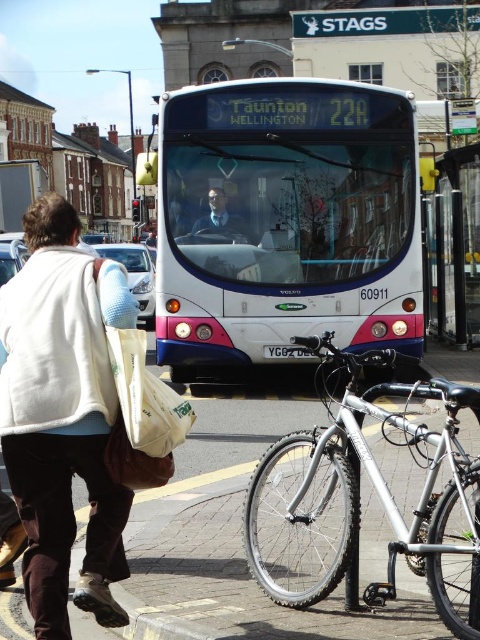
You are standing at the bus stop and want to know which of the two points, point (x=469, y=397) or point (x=241, y=237), is closer to you. Can you determine this based on the scene?

Point (x=469, y=397) is closer to the viewer than point (x=241, y=237).

What are the coordinates of the white glossy bus at center in the image?

The white glossy bus at center is located at coordinates (286, 221).